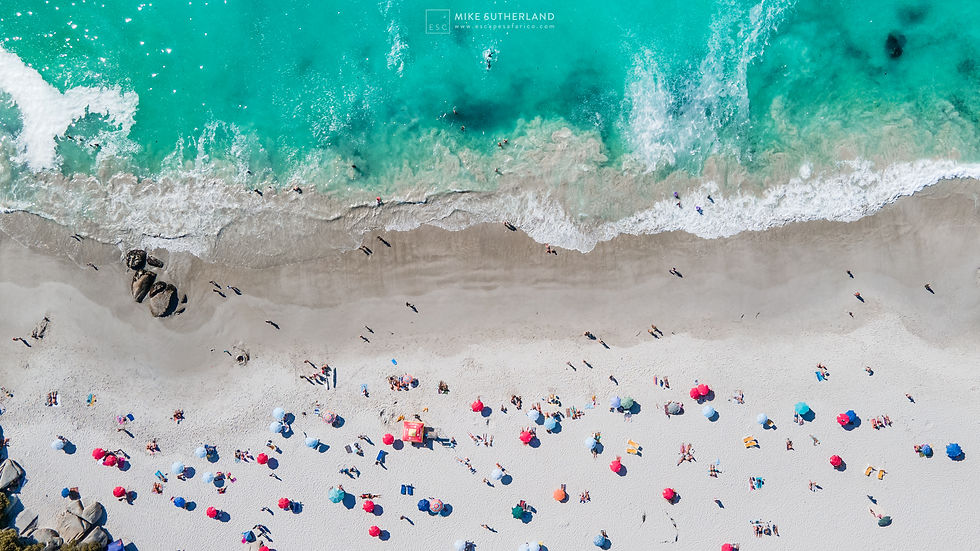
Image resolution: width=980 pixels, height=551 pixels. Find the location of `towels`. towels is located at coordinates (864, 455).